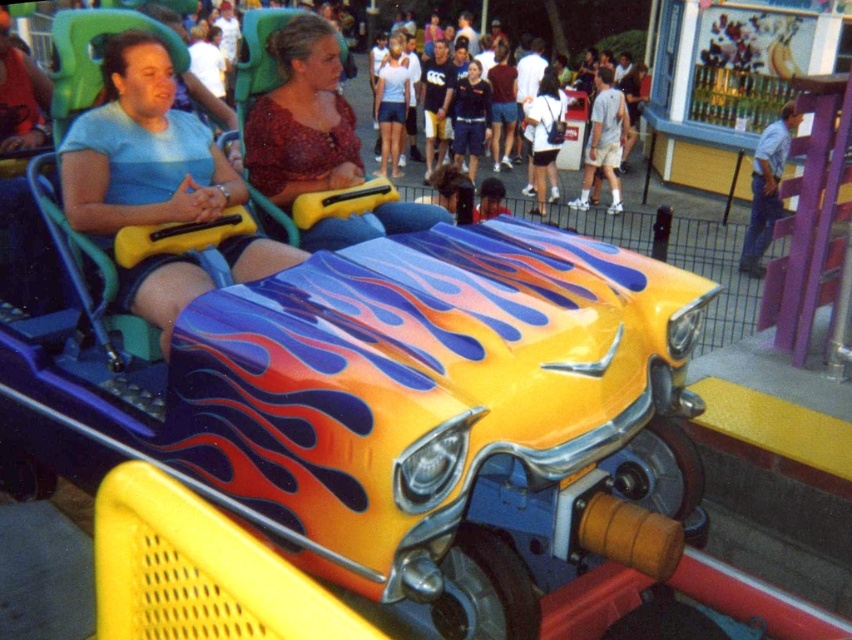
Question: Can you confirm if matte blue shorts at left is positioned to the left of matte red blouse at center?

Choices:
 (A) no
 (B) yes

Answer: (B)

Question: Which point is closer to the camera?

Choices:
 (A) matte red blouse at center
 (B) matte blue shorts at left

Answer: (B)

Question: Which object is farther from the camera taking this photo?

Choices:
 (A) matte red blouse at center
 (B) matte blue shorts at left

Answer: (A)

Question: Does matte blue shorts at left appear on the right side of matte red blouse at center?

Choices:
 (A) yes
 (B) no

Answer: (B)

Question: Which point appears farthest from the camera in this image?

Choices:
 (A) (263, 161)
 (B) (98, 161)

Answer: (A)

Question: Does matte blue shorts at left appear over matte red blouse at center?

Choices:
 (A) yes
 (B) no

Answer: (B)